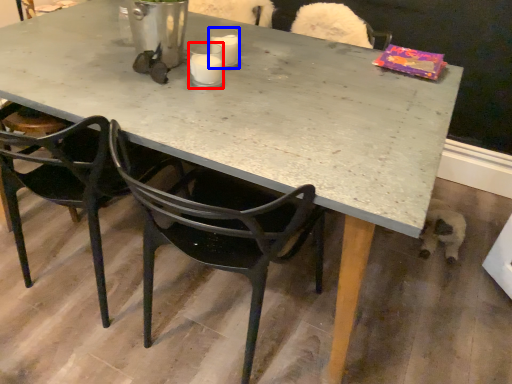
Question: Which object is closer to the camera taking this photo, coffee cup (highlighted by a red box) or coffee cup (highlighted by a blue box)?

Choices:
 (A) coffee cup
 (B) coffee cup

Answer: (A)